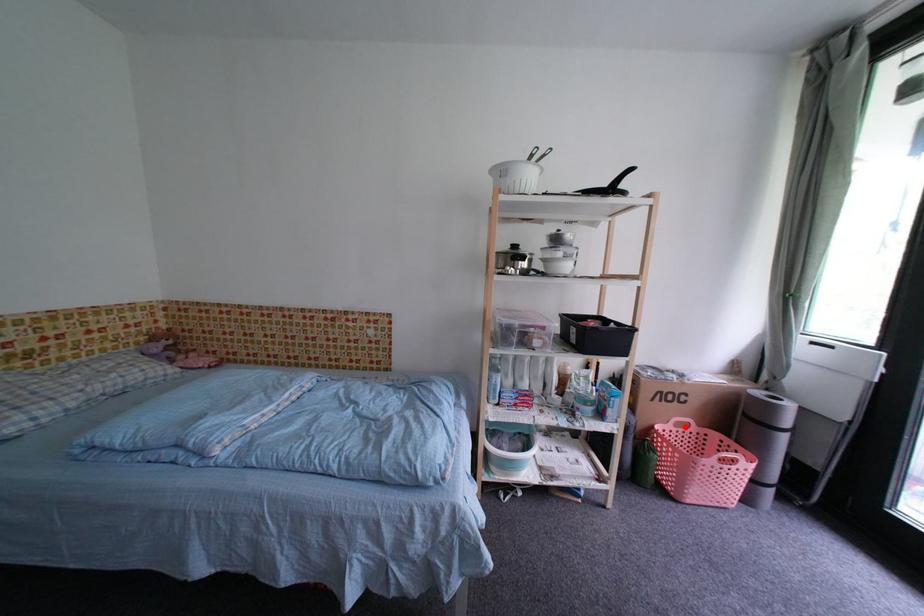
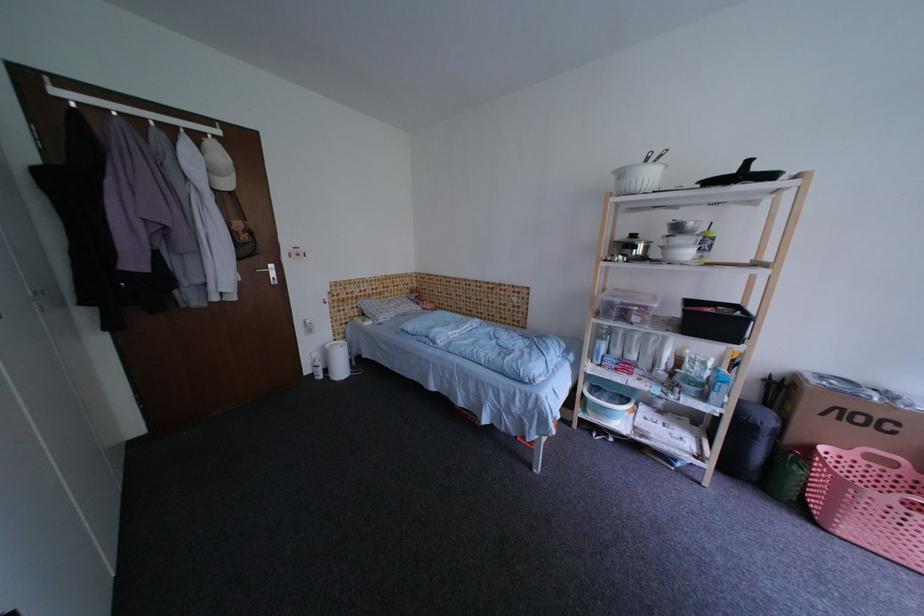
Question: I am providing you with two images of the same scene from different viewpoints. Given a red point in image1, look at the same physical point in image2. Is it:

Choices:
 (A) Closer to the viewpoint
 (B) Farther from the viewpoint

Answer: (B)